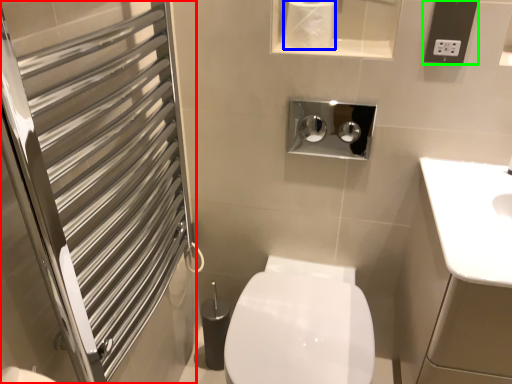
Question: Which is farther away from screen door (highlighted by a red box)? toilet paper (highlighted by a blue box) or electric outlet (highlighted by a green box)?

Choices:
 (A) toilet paper
 (B) electric outlet

Answer: (B)